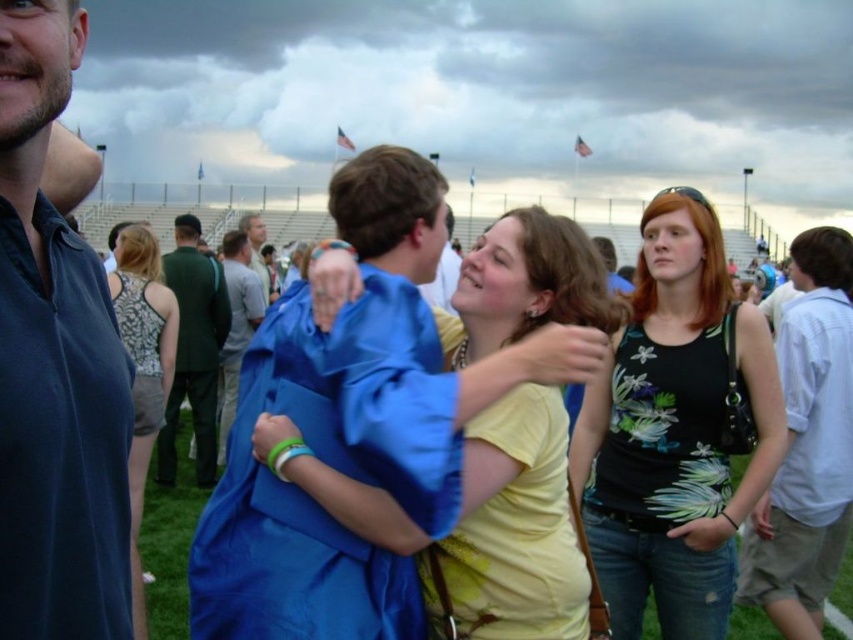
Question: Does yellow matte shirt at center appear over white cotton shirt at right?

Choices:
 (A) yes
 (B) no

Answer: (B)

Question: Among these objects, which one is farthest from the camera?

Choices:
 (A) blue fabric jacket at center
 (B) dark blue polo shirt at left
 (C) dark green suit at center
 (D) white cotton shirt at right

Answer: (A)

Question: Can you confirm if white cotton shirt at right is positioned below printed fabric tank top at center?

Choices:
 (A) yes
 (B) no

Answer: (A)

Question: Which of these objects is positioned closest to the dark blue polo shirt at left?

Choices:
 (A) dark green suit at center
 (B) printed fabric tank top at center
 (C) white cotton shirt at right

Answer: (B)

Question: Can you confirm if blue fabric jacket at center is positioned above light brown hair at center?

Choices:
 (A) yes
 (B) no

Answer: (B)

Question: Which point is closer to the camera taking this photo?

Choices:
 (A) (143, 448)
 (B) (177, 413)

Answer: (A)